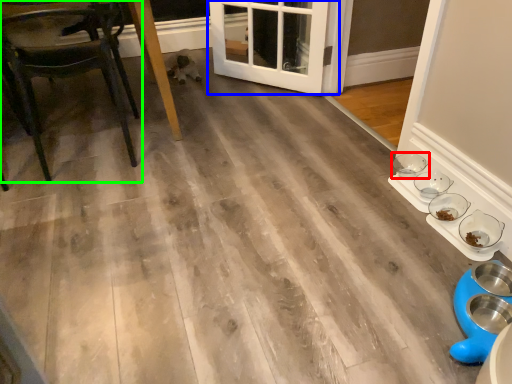
Question: Based on their relative distances, which object is nearer to bowl (highlighted by a red box)? Choose from door (highlighted by a blue box) and chair (highlighted by a green box).

Choices:
 (A) door
 (B) chair

Answer: (A)